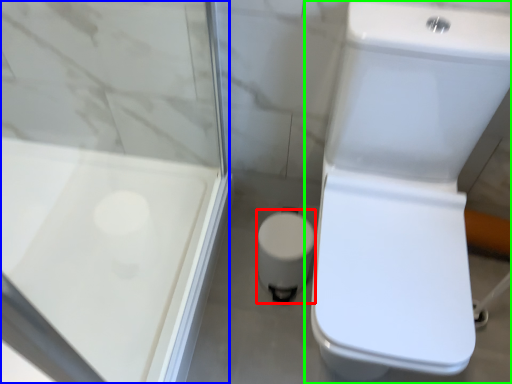
Question: Estimate the real-world distances between objects in this image. Which object is farther from porcelain (highlighted by a red box), screen door (highlighted by a blue box) or toilet (highlighted by a green box)?

Choices:
 (A) screen door
 (B) toilet

Answer: (A)